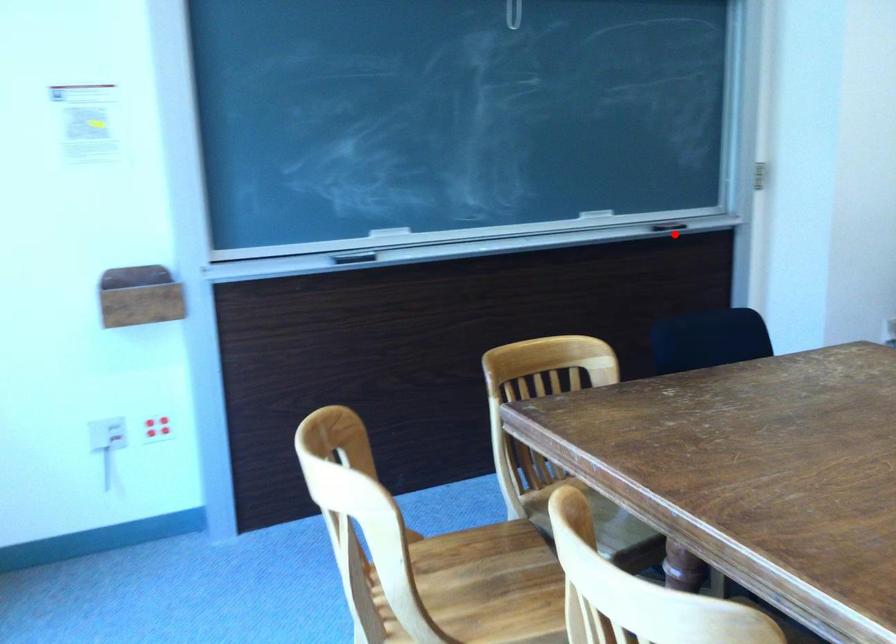
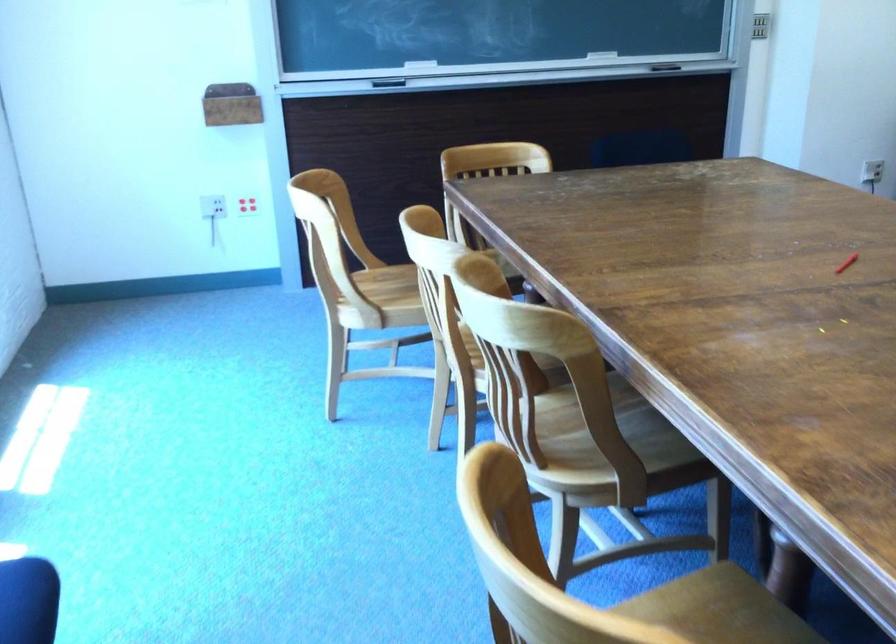
Locate, in the second image, the point that corresponds to the highlighted location in the first image.

(665, 67)